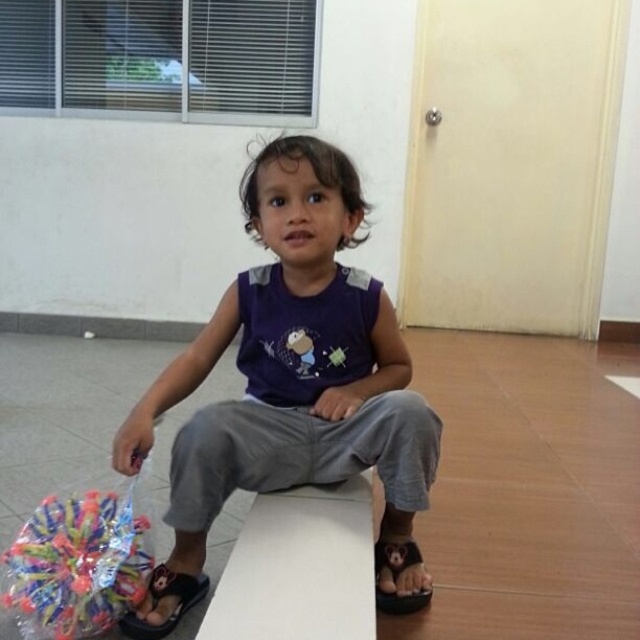
Who is more distant from viewer, (170,577) or (412,554)?

Positioned behind is point (412,554).

Between point (168, 614) and point (397, 611), which one is positioned behind?

The point (397, 611) is behind.

At what (x,y) coordinates should I click in order to perform the action: click on black rubber sandal at lower left. Please return your answer as a coordinate pair (x, y). This screenshot has width=640, height=640. Looking at the image, I should click on (163, 598).

Does translucent plastic toy at lower left appear on the left side of black rubber sandal at lower left?

Yes, translucent plastic toy at lower left is to the left of black rubber sandal at lower left.

Can you confirm if translucent plastic toy at lower left is positioned above black rubber sandal at lower left?

Indeed, translucent plastic toy at lower left is positioned over black rubber sandal at lower left.

The image size is (640, 640). Identify the location of translucent plastic toy at lower left. (76, 564).

Is point (132, 593) positioned after point (417, 604)?

No, it is in front of (417, 604).

Which is in front, point (40, 604) or point (401, 557)?

Positioned in front is point (40, 604).

Is point (81, 540) positioned in front of point (381, 611)?

Yes, it is in front of point (381, 611).

The image size is (640, 640). I want to click on translucent plastic toy at lower left, so click(76, 564).